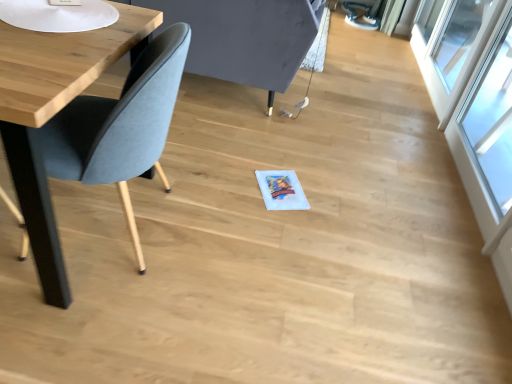
Question: Is transparent glass window at right, marked as the second window in a back-to-front arrangement, located outside transparent glass window at upper right, which is the 1th window from back to front?

Choices:
 (A) yes
 (B) no

Answer: (A)

Question: Is the position of transparent glass window at right, which is the first window in front-to-back order, less distant than that of transparent glass window at upper right, acting as the second window starting from the front?

Choices:
 (A) yes
 (B) no

Answer: (A)

Question: Can you confirm if transparent glass window at right, marked as the second window in a back-to-front arrangement, is bigger than transparent glass window at upper right, acting as the second window starting from the front?

Choices:
 (A) no
 (B) yes

Answer: (A)

Question: Is transparent glass window at right, which is the first window in front-to-back order, at the right side of transparent glass window at upper right, acting as the second window starting from the front?

Choices:
 (A) no
 (B) yes

Answer: (A)

Question: Can you confirm if transparent glass window at right, marked as the second window in a back-to-front arrangement, is thinner than transparent glass window at upper right, which is the 1th window from back to front?

Choices:
 (A) no
 (B) yes

Answer: (A)

Question: Are transparent glass window at right, which is the first window in front-to-back order, and transparent glass window at upper right, acting as the second window starting from the front, located far from each other?

Choices:
 (A) no
 (B) yes

Answer: (A)

Question: Considering the relative sizes of transparent glass window at upper right, which is the 1th window from back to front, and matte blue chair at left in the image provided, is transparent glass window at upper right, which is the 1th window from back to front, smaller than matte blue chair at left?

Choices:
 (A) yes
 (B) no

Answer: (A)

Question: Is transparent glass window at upper right, acting as the second window starting from the front, not inside matte blue chair at left?

Choices:
 (A) yes
 (B) no

Answer: (A)

Question: From the image's perspective, does transparent glass window at upper right, acting as the second window starting from the front, appear higher than matte blue chair at left?

Choices:
 (A) no
 (B) yes

Answer: (B)

Question: Considering the relative sizes of transparent glass window at upper right, acting as the second window starting from the front, and matte blue chair at left in the image provided, is transparent glass window at upper right, acting as the second window starting from the front, taller than matte blue chair at left?

Choices:
 (A) yes
 (B) no

Answer: (A)

Question: Are transparent glass window at upper right, acting as the second window starting from the front, and matte blue chair at left beside each other?

Choices:
 (A) no
 (B) yes

Answer: (A)

Question: Can you confirm if transparent glass window at upper right, acting as the second window starting from the front, is positioned to the right of matte blue chair at left?

Choices:
 (A) yes
 (B) no

Answer: (A)

Question: From the image's perspective, is transparent glass window at upper right, which is the 1th window from back to front, located beneath transparent glass window at right, which is the first window in front-to-back order?

Choices:
 (A) yes
 (B) no

Answer: (B)